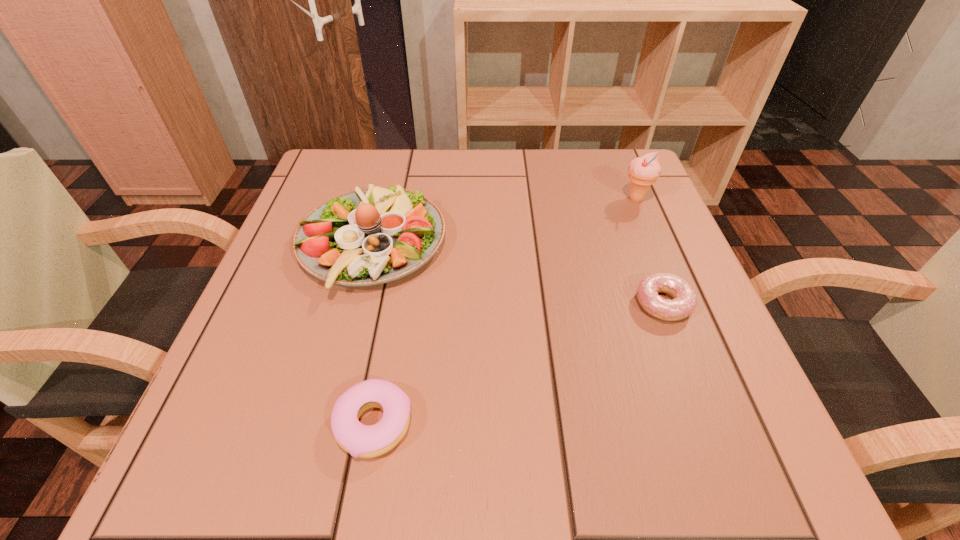
I want to click on the tallest object, so 643,171.

The image size is (960, 540). In order to click on the second tallest object in this screenshot , I will do `click(372, 236)`.

You are a GUI agent. You are given a task and a screenshot of the screen. Output one action in this format:
    pyautogui.click(x=<x>, y=<y>)
    Task: Click on the farther doughnut
    
    Given the screenshot: What is the action you would take?
    pyautogui.click(x=684, y=302)

I want to click on the left doughnut, so click(366, 441).

In order to click on the nearest object in this screenshot , I will do `click(366, 441)`.

Locate an element on the screen. The image size is (960, 540). vacant space located 0.110m on the left of the tallest object is located at coordinates (571, 199).

Identify the location of free space located 0.280m on the front of the second tallest object. (315, 467).

This screenshot has width=960, height=540. Identify the location of vacant space positioned 0.250m on the front of the farther doughnut. (730, 482).

Find the location of `free space located 0.070m on the back of the nearer doughnut`. free space located 0.070m on the back of the nearer doughnut is located at coordinates (387, 349).

Image resolution: width=960 pixels, height=540 pixels. In order to click on icecream that is positioned at the far edge in this screenshot , I will do `click(643, 171)`.